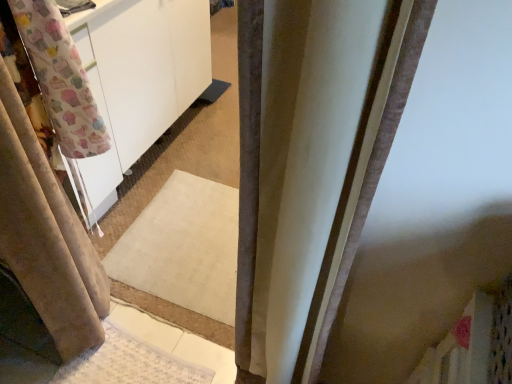
What do you see at coordinates (311, 164) in the screenshot? I see `satin beige curtain at center, which is counted as the second curtain, starting from the left` at bounding box center [311, 164].

Where is `satin beige curtain at center, the first curtain viewed from the right`? satin beige curtain at center, the first curtain viewed from the right is located at coordinates (311, 164).

Where is `beige fabric curtain at left, arranged as the 1th curtain when viewed from the left`? beige fabric curtain at left, arranged as the 1th curtain when viewed from the left is located at coordinates (46, 235).

The width and height of the screenshot is (512, 384). What do you see at coordinates (46, 235) in the screenshot?
I see `beige fabric curtain at left, which ranks as the 2th curtain in right-to-left order` at bounding box center [46, 235].

This screenshot has width=512, height=384. I want to click on satin beige curtain at center, the first curtain viewed from the right, so click(x=311, y=164).

Which object is positioned more to the right, satin beige curtain at center, the first curtain viewed from the right, or beige fabric curtain at left, which ranks as the 2th curtain in right-to-left order?

satin beige curtain at center, the first curtain viewed from the right.

Is satin beige curtain at center, which is counted as the second curtain, starting from the left, in front of or behind beige fabric curtain at left, arranged as the 1th curtain when viewed from the left, in the image?

satin beige curtain at center, which is counted as the second curtain, starting from the left, is in front of beige fabric curtain at left, arranged as the 1th curtain when viewed from the left.

Which is closer to the camera, (345, 248) or (54, 247)?

Clearly, point (345, 248) is closer to the camera than point (54, 247).

From the image's perspective, is satin beige curtain at center, the first curtain viewed from the right, under beige fabric curtain at left, arranged as the 1th curtain when viewed from the left?

No, from the image's perspective, satin beige curtain at center, the first curtain viewed from the right, is not below beige fabric curtain at left, arranged as the 1th curtain when viewed from the left.

From a real-world perspective, between satin beige curtain at center, which is counted as the second curtain, starting from the left, and beige fabric curtain at left, which ranks as the 2th curtain in right-to-left order, who is vertically higher?

satin beige curtain at center, which is counted as the second curtain, starting from the left.

Considering the relative sizes of satin beige curtain at center, the first curtain viewed from the right, and beige fabric curtain at left, arranged as the 1th curtain when viewed from the left, in the image provided, is satin beige curtain at center, the first curtain viewed from the right, wider than beige fabric curtain at left, arranged as the 1th curtain when viewed from the left,?

Indeed, satin beige curtain at center, the first curtain viewed from the right, has a greater width compared to beige fabric curtain at left, arranged as the 1th curtain when viewed from the left.

Is satin beige curtain at center, which is counted as the second curtain, starting from the left, shorter than beige fabric curtain at left, arranged as the 1th curtain when viewed from the left?

No.

Between satin beige curtain at center, which is counted as the second curtain, starting from the left, and beige fabric curtain at left, which ranks as the 2th curtain in right-to-left order, which one has larger size?

satin beige curtain at center, which is counted as the second curtain, starting from the left, is bigger.

Is satin beige curtain at center, the first curtain viewed from the right, completely or partially outside of beige fabric curtain at left, which ranks as the 2th curtain in right-to-left order?

Indeed, satin beige curtain at center, the first curtain viewed from the right, is completely outside beige fabric curtain at left, which ranks as the 2th curtain in right-to-left order.

Is satin beige curtain at center, which is counted as the second curtain, starting from the left, not close to beige fabric curtain at left, arranged as the 1th curtain when viewed from the left?

That's not correct — satin beige curtain at center, which is counted as the second curtain, starting from the left, is a little close to beige fabric curtain at left, arranged as the 1th curtain when viewed from the left.

Is beige fabric curtain at left, arranged as the 1th curtain when viewed from the left, at the back of satin beige curtain at center, which is counted as the second curtain, starting from the left?

satin beige curtain at center, which is counted as the second curtain, starting from the left, is not turned away from beige fabric curtain at left, arranged as the 1th curtain when viewed from the left.

Consider the image. How many degrees apart are the facing directions of satin beige curtain at center, which is counted as the second curtain, starting from the left, and beige fabric curtain at left, arranged as the 1th curtain when viewed from the left?

The facing directions of satin beige curtain at center, which is counted as the second curtain, starting from the left, and beige fabric curtain at left, arranged as the 1th curtain when viewed from the left, are 0.00133 degrees apart.

Identify the location of curtain above the beige fabric curtain at left, arranged as the 1th curtain when viewed from the left (from the image's perspective). Image resolution: width=512 pixels, height=384 pixels. (311, 164).

In the image, is beige fabric curtain at left, arranged as the 1th curtain when viewed from the left, on the left side or the right side of satin beige curtain at center, the first curtain viewed from the right?

Clearly, beige fabric curtain at left, arranged as the 1th curtain when viewed from the left, is on the left of satin beige curtain at center, the first curtain viewed from the right, in the image.

Who is more distant, beige fabric curtain at left, arranged as the 1th curtain when viewed from the left, or satin beige curtain at center, which is counted as the second curtain, starting from the left?

beige fabric curtain at left, arranged as the 1th curtain when viewed from the left, is further away from the camera.

Considering the positions of points (2, 108) and (304, 282), is point (2, 108) closer to camera compared to point (304, 282)?

That is False.

From the image's perspective, between beige fabric curtain at left, which ranks as the 2th curtain in right-to-left order, and satin beige curtain at center, which is counted as the second curtain, starting from the left, which one is located above?

satin beige curtain at center, which is counted as the second curtain, starting from the left.

From a real-world perspective, between beige fabric curtain at left, which ranks as the 2th curtain in right-to-left order, and satin beige curtain at center, the first curtain viewed from the right, who is vertically higher?

In real-world perspective, satin beige curtain at center, the first curtain viewed from the right, is above.

Which of these two, beige fabric curtain at left, which ranks as the 2th curtain in right-to-left order, or satin beige curtain at center, the first curtain viewed from the right, is thinner?

beige fabric curtain at left, which ranks as the 2th curtain in right-to-left order.

Who is shorter, beige fabric curtain at left, arranged as the 1th curtain when viewed from the left, or satin beige curtain at center, the first curtain viewed from the right?

beige fabric curtain at left, arranged as the 1th curtain when viewed from the left, is shorter.

Considering the sizes of objects beige fabric curtain at left, arranged as the 1th curtain when viewed from the left, and satin beige curtain at center, which is counted as the second curtain, starting from the left, in the image provided, who is smaller, beige fabric curtain at left, arranged as the 1th curtain when viewed from the left, or satin beige curtain at center, which is counted as the second curtain, starting from the left,?

Smaller between the two is beige fabric curtain at left, arranged as the 1th curtain when viewed from the left.

Is beige fabric curtain at left, arranged as the 1th curtain when viewed from the left, surrounding satin beige curtain at center, which is counted as the second curtain, starting from the left?

No, satin beige curtain at center, which is counted as the second curtain, starting from the left, is not inside beige fabric curtain at left, arranged as the 1th curtain when viewed from the left.

Is beige fabric curtain at left, arranged as the 1th curtain when viewed from the left, positioned far away from satin beige curtain at center, the first curtain viewed from the right?

beige fabric curtain at left, arranged as the 1th curtain when viewed from the left, is near satin beige curtain at center, the first curtain viewed from the right, not far away.

Does beige fabric curtain at left, which ranks as the 2th curtain in right-to-left order, turn towards satin beige curtain at center, which is counted as the second curtain, starting from the left?

No, beige fabric curtain at left, which ranks as the 2th curtain in right-to-left order, is not aimed at satin beige curtain at center, which is counted as the second curtain, starting from the left.

How distant is beige fabric curtain at left, arranged as the 1th curtain when viewed from the left, from satin beige curtain at center, which is counted as the second curtain, starting from the left?

25.92 inches.

Find the location of a particular element. The width and height of the screenshot is (512, 384). curtain lying on the left of satin beige curtain at center, which is counted as the second curtain, starting from the left is located at coordinates (46, 235).

What are the coordinates of `curtain located behind the satin beige curtain at center, the first curtain viewed from the right` in the screenshot? It's located at (46, 235).

What are the coordinates of `curtain above the beige fabric curtain at left, which ranks as the 2th curtain in right-to-left order (from the image's perspective)` in the screenshot? It's located at (x=311, y=164).